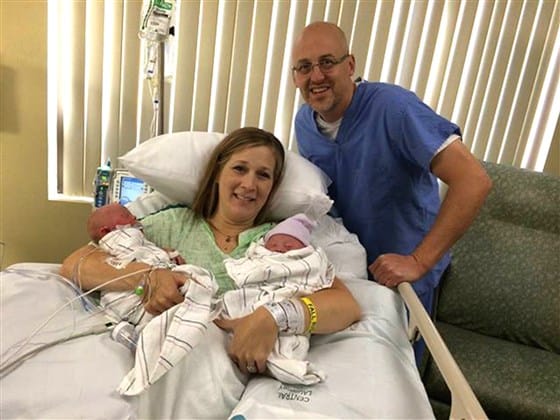
This screenshot has width=560, height=420. In order to click on blinds in this screenshot , I will do `click(82, 58)`, `click(212, 50)`, `click(373, 39)`, `click(493, 58)`.